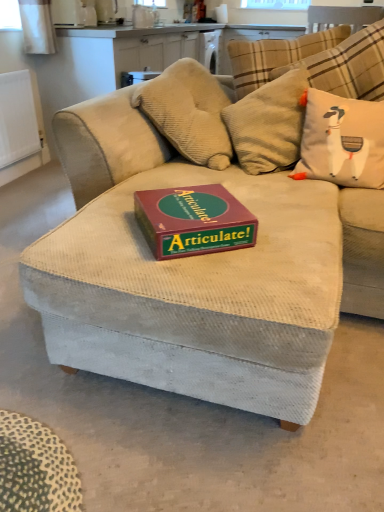
The height and width of the screenshot is (512, 384). What do you see at coordinates (18, 118) in the screenshot?
I see `white matte radiator at left` at bounding box center [18, 118].

Where is `white matte radiator at left`? Image resolution: width=384 pixels, height=512 pixels. white matte radiator at left is located at coordinates (18, 118).

At what (x,y) coordinates should I click in order to perform the action: click on white matte radiator at left. Please return your answer as a coordinate pair (x, y). The height and width of the screenshot is (512, 384). Looking at the image, I should click on (18, 118).

Which is in front, point (230, 213) or point (349, 129)?

The point (230, 213) is more forward.

Measure the distance from maroon cardboard articulate! game box on the center to white fabric pillow with cartoon llama at upper right.

28.62 inches.

Consider the image. From the image's perspective, is maroon cardboard articulate! game box on the center located above or below white fabric pillow with cartoon llama at upper right?

maroon cardboard articulate! game box on the center is below white fabric pillow with cartoon llama at upper right.

Is maroon cardboard articulate! game box on the center at the left side of white fabric pillow with cartoon llama at upper right?

Yes.

Is white matte radiator at left looking in the opposite direction of maroon cardboard articulate! game box on the center?

No, white matte radiator at left's orientation is not away from maroon cardboard articulate! game box on the center.

Is white matte radiator at left to the right of maroon cardboard articulate! game box on the center from the viewer's perspective?

Incorrect, white matte radiator at left is not on the right side of maroon cardboard articulate! game box on the center.

Does white matte radiator at left come behind maroon cardboard articulate! game box on the center?

Yes, white matte radiator at left is further from the camera.

From a real-world perspective, which object stands above the other?

In real-world perspective, maroon cardboard articulate! game box on the center is above.

Choose the correct answer: Is white fabric pillow with cartoon llama at upper right inside maroon cardboard articulate! game box on the center or outside it?

The correct answer is: outside.

Is white fabric pillow with cartoon llama at upper right not near maroon cardboard articulate! game box on the center?

No, white fabric pillow with cartoon llama at upper right is not far away from maroon cardboard articulate! game box on the center.

Between white fabric pillow with cartoon llama at upper right and maroon cardboard articulate! game box on the center, which one appears on the left side from the viewer's perspective?

Positioned to the left is maroon cardboard articulate! game box on the center.

Does white fabric pillow with cartoon llama at upper right have a greater height compared to maroon cardboard articulate! game box on the center?

Correct, white fabric pillow with cartoon llama at upper right is much taller as maroon cardboard articulate! game box on the center.

Considering the sizes of white fabric pillow with cartoon llama at upper right and white matte radiator at left in the image, is white fabric pillow with cartoon llama at upper right bigger or smaller than white matte radiator at left?

Clearly, white fabric pillow with cartoon llama at upper right is larger in size than white matte radiator at left.

Considering the relative sizes of white fabric pillow with cartoon llama at upper right and white matte radiator at left in the image provided, is white fabric pillow with cartoon llama at upper right shorter than white matte radiator at left?

Yes.

Based on the photo, is white fabric pillow with cartoon llama at upper right in contact with white matte radiator at left?

No, white fabric pillow with cartoon llama at upper right is not with white matte radiator at left.

Is white fabric pillow with cartoon llama at upper right positioned with its back to white matte radiator at left?

white fabric pillow with cartoon llama at upper right does not have its back to white matte radiator at left.

Can white fabric pillow with cartoon llama at upper right be found inside white matte radiator at left?

No, white fabric pillow with cartoon llama at upper right is located outside of white matte radiator at left.

Is white matte radiator at left at the left side of white fabric pillow with cartoon llama at upper right?

Correct, you'll find white matte radiator at left to the left of white fabric pillow with cartoon llama at upper right.

Considering the sizes of objects white matte radiator at left and white fabric pillow with cartoon llama at upper right in the image provided, who is wider, white matte radiator at left or white fabric pillow with cartoon llama at upper right?

white fabric pillow with cartoon llama at upper right is wider.

In terms of size, does white matte radiator at left appear bigger or smaller than white fabric pillow with cartoon llama at upper right?

white matte radiator at left is smaller than white fabric pillow with cartoon llama at upper right.

Is white matte radiator at left at the back of maroon cardboard articulate! game box on the center?

Yes, maroon cardboard articulate! game box on the center's orientation is away from white matte radiator at left.

Please point to radiator on the left of maroon cardboard articulate! game box on the center. Please provide its 2D coordinates.

[(18, 118)]

Does point (176, 249) lie in front of point (22, 134)?

Yes, it is.

Find throw pillow that appears on the right of maroon cardboard articulate! game box on the center. Please provide its 2D coordinates.

[(342, 141)]

From the image's perspective, please find the radiator located above the maroon cardboard articulate! game box on the center. Please provide its 2D coordinates.

[(18, 118)]

From the image, which object appears to be farther from white matte radiator at left, white fabric pillow with cartoon llama at upper right or maroon cardboard articulate! game box on the center?

maroon cardboard articulate! game box on the center.

Based on the photo, based on their spatial positions, is white fabric pillow with cartoon llama at upper right or white matte radiator at left further from maroon cardboard articulate! game box on the center?

white matte radiator at left lies further to maroon cardboard articulate! game box on the center than the other object.

From the picture: Estimate the real-world distances between objects in this image. Which object is further from white fabric pillow with cartoon llama at upper right, white matte radiator at left or maroon cardboard articulate! game box on the center?

The object further to white fabric pillow with cartoon llama at upper right is white matte radiator at left.

In the scene shown: From the image, which object appears to be farther from maroon cardboard articulate! game box on the center, white matte radiator at left or white fabric pillow with cartoon llama at upper right?

Based on the image, white matte radiator at left appears to be further to maroon cardboard articulate! game box on the center.

When comparing their distances from white fabric pillow with cartoon llama at upper right, does maroon cardboard articulate! game box on the center or white matte radiator at left seem closer?

maroon cardboard articulate! game box on the center is closer to white fabric pillow with cartoon llama at upper right.

Looking at the image, which one is located closer to white matte radiator at left, maroon cardboard articulate! game box on the center or white fabric pillow with cartoon llama at upper right?

white fabric pillow with cartoon llama at upper right lies closer to white matte radiator at left than the other object.

Where is `paperback book between white matte radiator at left and white fabric pillow with cartoon llama at upper right in the horizontal direction`? This screenshot has width=384, height=512. paperback book between white matte radiator at left and white fabric pillow with cartoon llama at upper right in the horizontal direction is located at coordinates (193, 221).